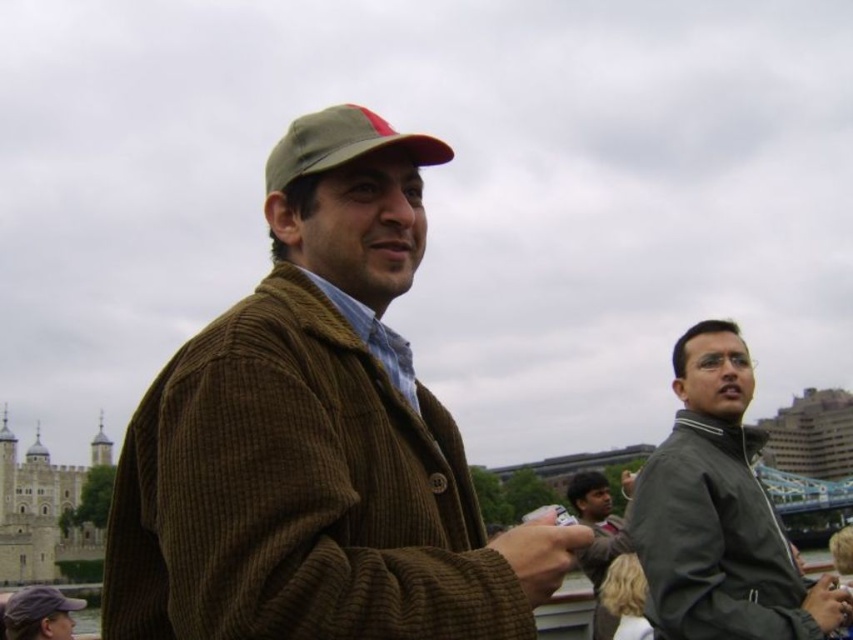
Question: Which point is farther to the camera?

Choices:
 (A) (604, 566)
 (B) (32, 612)
 (C) (544, 552)
 (D) (730, 618)

Answer: (A)

Question: Among these objects, which one is nearest to the camera?

Choices:
 (A) matte brown cap at center
 (B) dark green corduroy jacket at center
 (C) matte gray jacket at right
 (D) brown corduroy hand at center

Answer: (D)

Question: Does brown corduroy jacket at center have a smaller size compared to brown corduroy hand at center?

Choices:
 (A) no
 (B) yes

Answer: (A)

Question: Estimate the real-world distances between objects in this image. Which object is farther from the brown corduroy hand at center?

Choices:
 (A) matte gray jacket at right
 (B) green corduroy baseball cap at center
 (C) matte black hand at lower right

Answer: (B)

Question: Can you confirm if matte gray jacket at right is positioned to the right of green corduroy baseball cap at center?

Choices:
 (A) no
 (B) yes

Answer: (B)

Question: Does brown corduroy hand at center have a greater width compared to matte black hand at lower right?

Choices:
 (A) no
 (B) yes

Answer: (A)